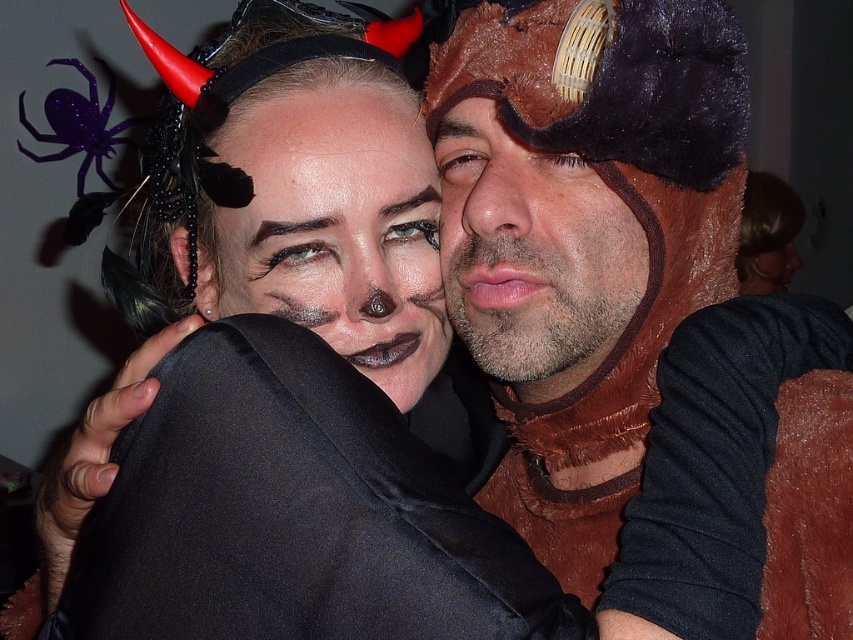
You are a photographer trying to capture a closeup of the black satin jacket at center. You see a point at coordinates point (293, 513). Is this point located on the black satin jacket at center?

Yes, the point (293, 513) is located on the black satin jacket at center according to the description.

You are standing in front of the two costumed individuals and want to know which point is nearer to you. Can you determine which of the two points, point (215, 273) or point (53, 136), is closer to you?

Point (215, 273) is closer to the viewer than point (53, 136).